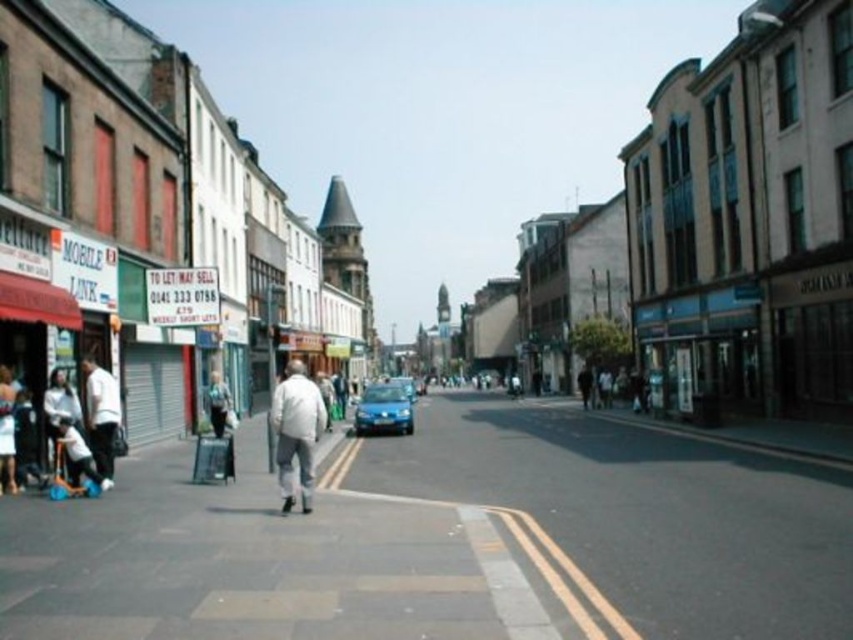
Question: Can you confirm if white matte jacket at center is bigger than light blue denim jacket at center?

Choices:
 (A) no
 (B) yes

Answer: (B)

Question: Does smooth concrete pavement at lower left appear on the left side of satin blue car at center?

Choices:
 (A) yes
 (B) no

Answer: (B)

Question: Which object appears closest to the camera in this image?

Choices:
 (A) blue metallic car at center
 (B) white matte jacket at lower left
 (C) light blue denim jacket at center
 (D) satin blue car at center

Answer: (B)

Question: In this image, where is white matte jacket at lower left located relative to light blue denim jacket at center?

Choices:
 (A) right
 (B) left

Answer: (A)

Question: Which object is farther from the camera taking this photo?

Choices:
 (A) light blue denim jacket at center
 (B) white matte jacket at lower left

Answer: (A)

Question: Among these points, which one is nearest to the camera?

Choices:
 (A) (289, 417)
 (B) (395, 428)
 (C) (830, 515)
 (D) (412, 380)

Answer: (C)